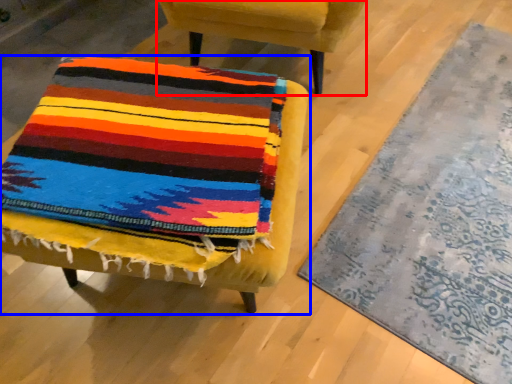
Question: Which point is closer to the camera, chair (highlighted by a red box) or chair (highlighted by a blue box)?

Choices:
 (A) chair
 (B) chair

Answer: (B)